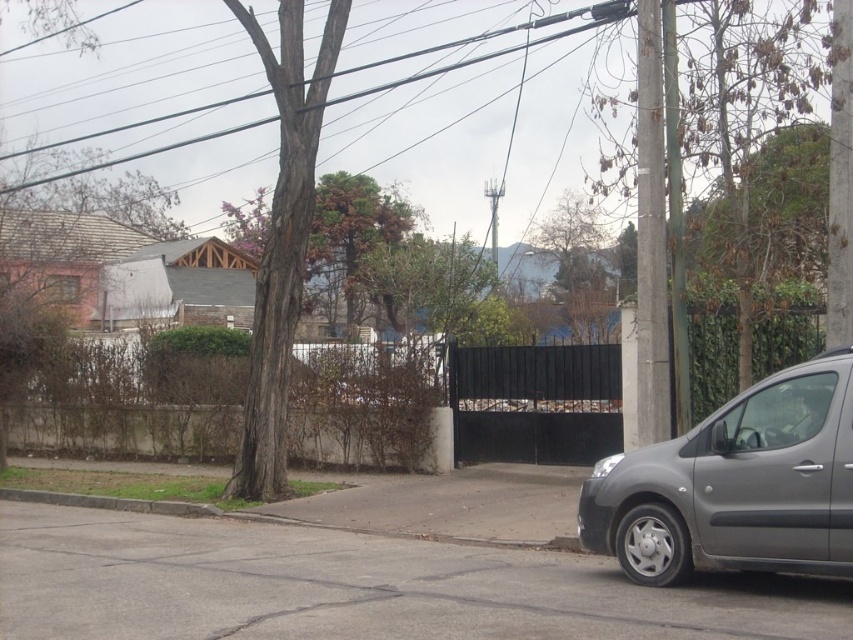
Between point (527, 38) and point (64, 499), which one is positioned behind?

The point (527, 38) is more distant.

The width and height of the screenshot is (853, 640). What do you see at coordinates (498, 49) in the screenshot?
I see `black wire at upper center` at bounding box center [498, 49].

Is point (236, 131) farther from camera compared to point (200, 509)?

Yes, point (236, 131) is farther from viewer.

You are a GUI agent. You are given a task and a screenshot of the screen. Output one action in this format:
    pyautogui.click(x=<x>, y=<y>)
    Task: Click on the black wire at upper center
    
    Given the screenshot: What is the action you would take?
    pyautogui.click(x=498, y=49)

The width and height of the screenshot is (853, 640). I want to click on satin gray van at right, so (x=735, y=484).

Who is more forward, (x=590, y=499) or (x=256, y=385)?

Positioned in front is point (x=590, y=499).

What do you see at coordinates (735, 484) in the screenshot? I see `satin gray van at right` at bounding box center [735, 484].

Is point (743, 420) more distant than point (283, 140)?

No, (743, 420) is in front of (283, 140).

Find the location of `satin gray van at right`. satin gray van at right is located at coordinates (735, 484).